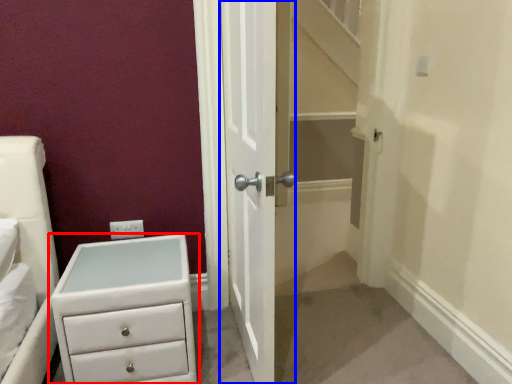
Question: Which object is further to the camera taking this photo, chest of drawers (highlighted by a red box) or door (highlighted by a blue box)?

Choices:
 (A) chest of drawers
 (B) door

Answer: (A)